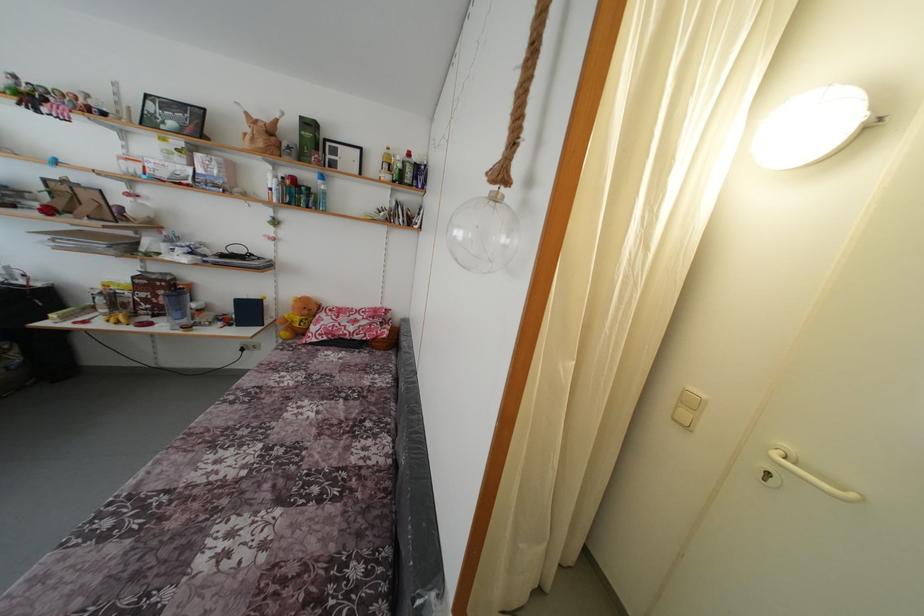
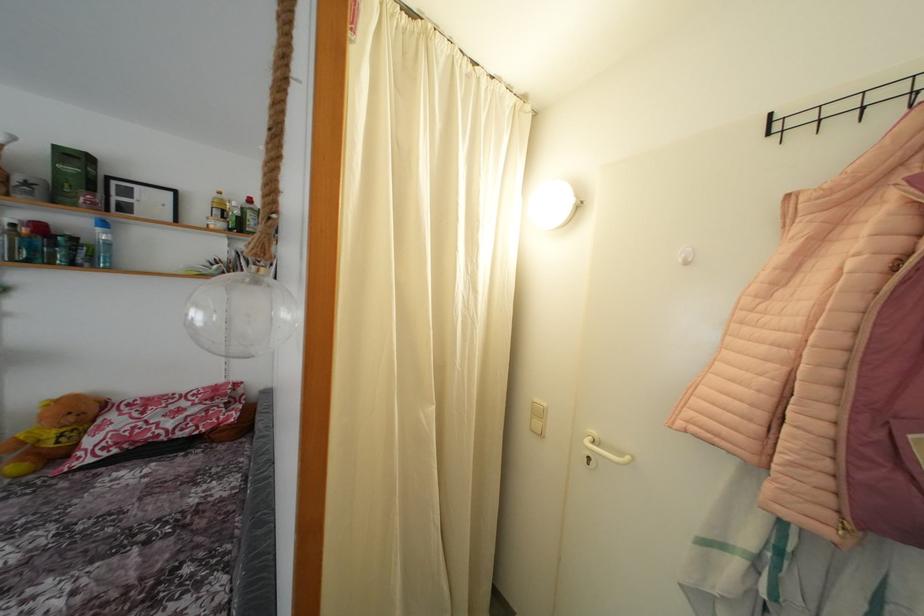
Locate, in the second image, the point that corresponds to (x=314, y=131) in the first image.

(80, 163)